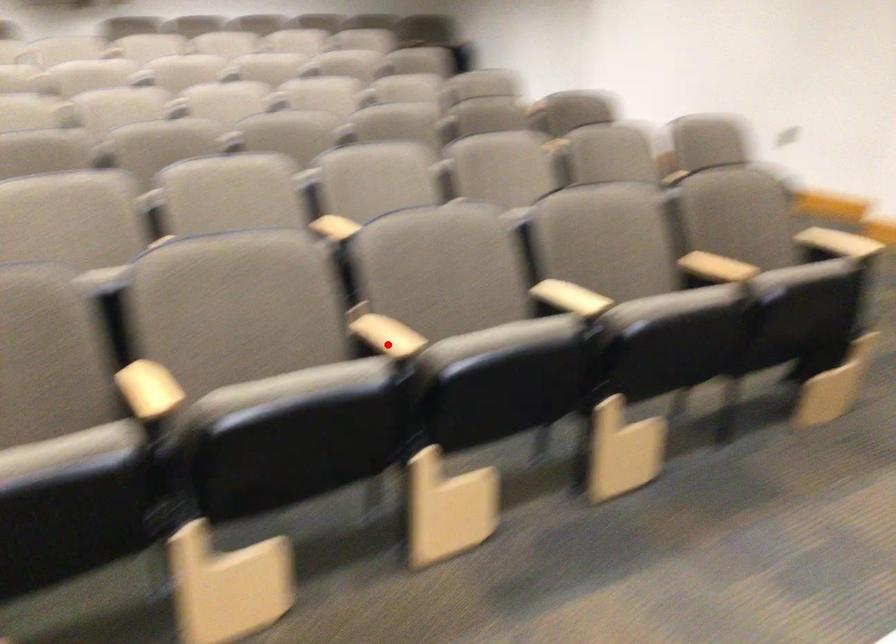
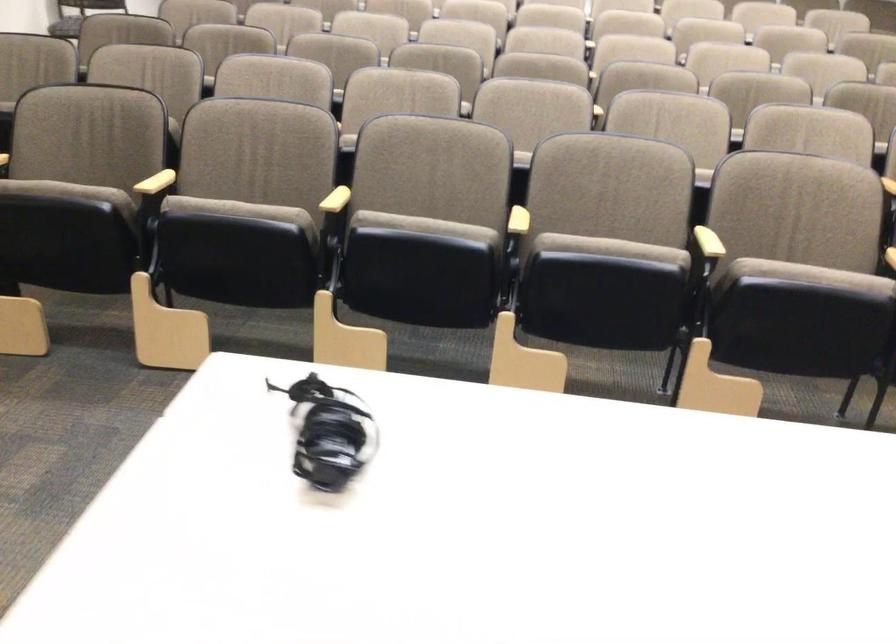
Where in the second image is the point corresponding to the highlighted location from the first image?

(518, 221)